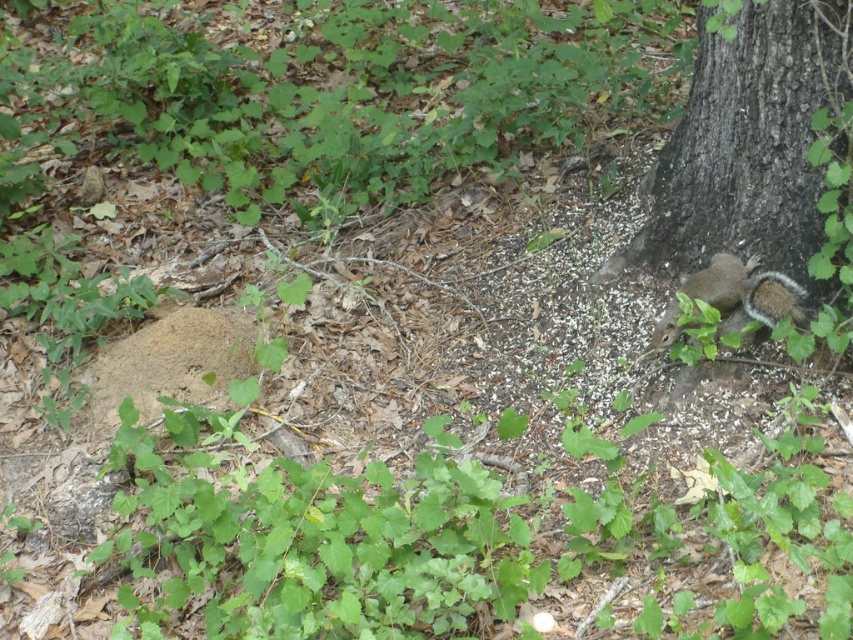
You are standing at the center of the forest floor scene. You see a point labeled as point (747, 141). What object is located at that point?

The point (747, 141) indicates the location of the brown rough bark tree at lower right.